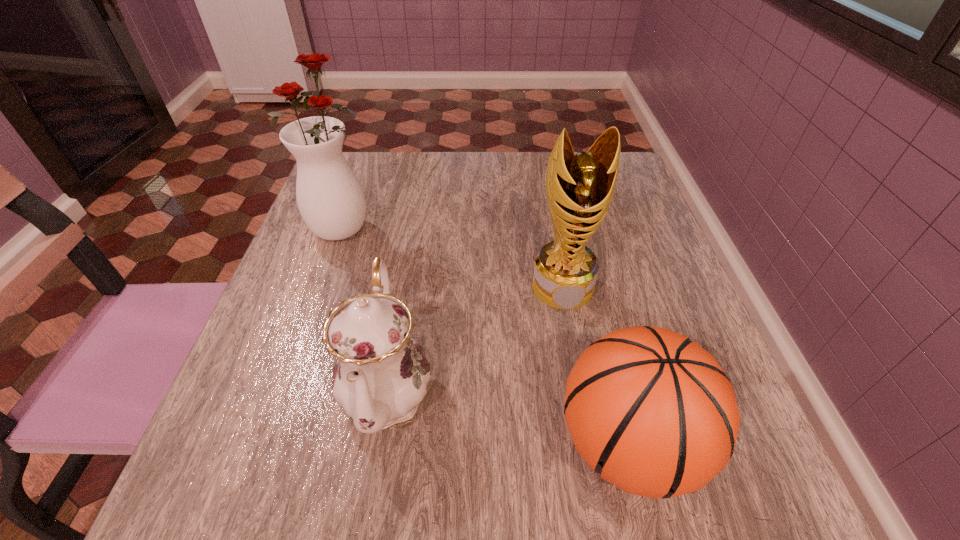
Find the location of a particular element. This screenshot has width=960, height=540. vase is located at coordinates (330, 198).

This screenshot has width=960, height=540. In order to click on the leftmost object in this screenshot , I will do `click(330, 198)`.

At what (x,y) coordinates should I click in order to perform the action: click on the third nearest object. Please return your answer as a coordinate pair (x, y). This screenshot has width=960, height=540. Looking at the image, I should click on (579, 188).

The image size is (960, 540). In order to click on the third object from right to left in this screenshot , I will do `click(380, 376)`.

Locate an element on the screen. The image size is (960, 540). basketball is located at coordinates (652, 412).

The width and height of the screenshot is (960, 540). I want to click on free space located 0.400m on the right of the farthest object, so click(x=552, y=228).

The width and height of the screenshot is (960, 540). Find the location of `vacant area located 0.110m on the front-facing side of the award`. vacant area located 0.110m on the front-facing side of the award is located at coordinates (576, 360).

The width and height of the screenshot is (960, 540). Identify the location of vacant region located on the right of the second object from left to right. click(x=559, y=388).

Find the location of a particular element. free space located 0.260m on the back of the basketball is located at coordinates (586, 269).

Find the location of a particular element. This screenshot has height=540, width=960. chinaware located in the near edge section of the desktop is located at coordinates (380, 376).